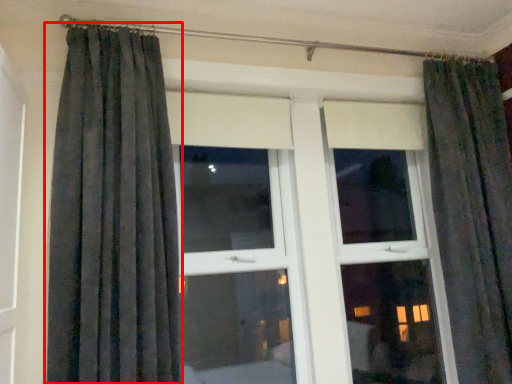
Question: Considering the relative positions of curtain (annotated by the red box) and bay window in the image provided, where is curtain (annotated by the red box) located with respect to the staircase?

Choices:
 (A) left
 (B) right

Answer: (A)